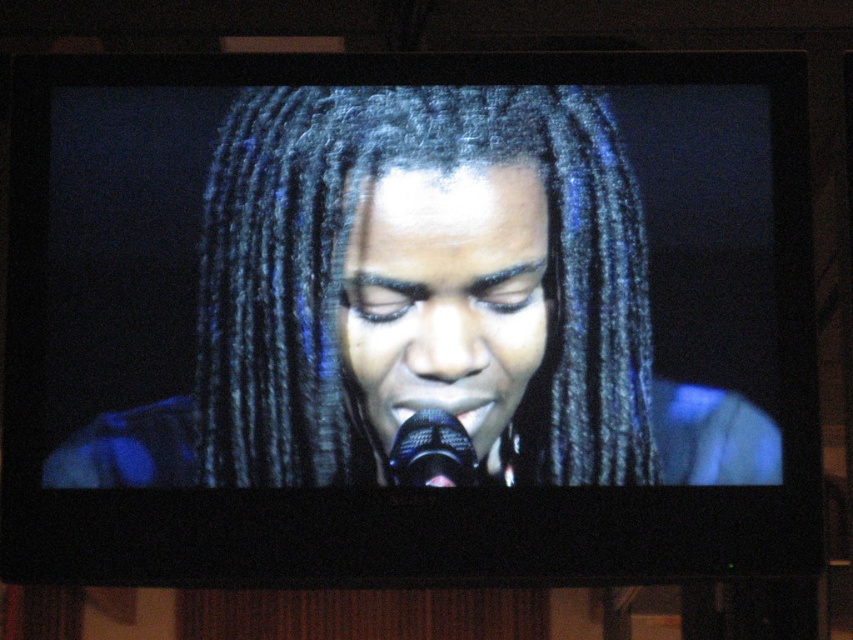
You are standing in front of the TV and want to point out two specific points on the screen. The first point is at coordinates point (x=260, y=97) and the second is at point (x=416, y=483). Which of these points is closer to the front of the TV screen?

Point (x=416, y=483) is closer to the front of the TV screen because point (x=260, y=97) is behind it according to their positions.